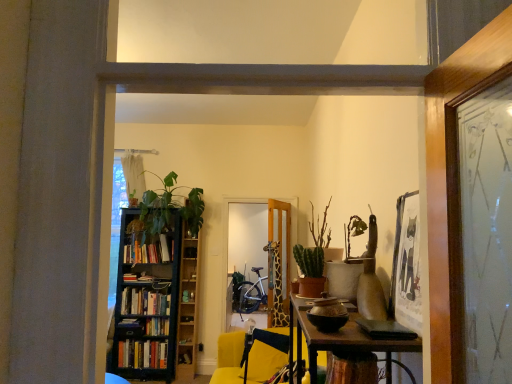
Question: Considering the relative positions of hardcover books at left, which is counted as the third book, starting from the bottom, and green matte plant at center in the image provided, is hardcover books at left, which is counted as the third book, starting from the bottom, to the left of green matte plant at center from the viewer's perspective?

Choices:
 (A) no
 (B) yes

Answer: (B)

Question: Does hardcover books at left, which is counted as the third book, starting from the bottom, have a smaller size compared to green matte plant at center?

Choices:
 (A) no
 (B) yes

Answer: (A)

Question: Can you confirm if hardcover books at left, which is counted as the third book, starting from the bottom, is shorter than green matte plant at center?

Choices:
 (A) yes
 (B) no

Answer: (A)

Question: Does hardcover books at left, which is counted as the third book, starting from the bottom, have a greater height compared to green matte plant at center?

Choices:
 (A) yes
 (B) no

Answer: (B)

Question: Does hardcover books at left, which is counted as the third book, starting from the bottom, appear on the right side of green matte plant at center?

Choices:
 (A) no
 (B) yes

Answer: (A)

Question: Is point pyautogui.click(x=304, y=251) closer or farther from the camera than point pyautogui.click(x=140, y=236)?

Choices:
 (A) farther
 (B) closer

Answer: (B)

Question: From a real-world perspective, is green matte plant at center positioned above or below black wooden bookcase at left?

Choices:
 (A) above
 (B) below

Answer: (A)

Question: Looking at the image, does green matte plant at center seem bigger or smaller compared to black wooden bookcase at left?

Choices:
 (A) small
 (B) big

Answer: (A)

Question: In the image, is green matte plant at center positioned in front of or behind black wooden bookcase at left?

Choices:
 (A) behind
 (B) front

Answer: (B)

Question: Considering the positions of point (322, 258) and point (289, 231), is point (322, 258) closer or farther from the camera than point (289, 231)?

Choices:
 (A) closer
 (B) farther

Answer: (A)

Question: Considering the positions of green matte cactus at center-right, the second plant in the back-to-front sequence, and wooden giraffe at center in the image, is green matte cactus at center-right, the second plant in the back-to-front sequence, taller or shorter than wooden giraffe at center?

Choices:
 (A) short
 (B) tall

Answer: (A)

Question: In terms of width, does green matte cactus at center-right, which ranks as the first plant in right-to-left order, look wider or thinner when compared to wooden giraffe at center?

Choices:
 (A) thin
 (B) wide

Answer: (A)

Question: From a real-world perspective, is green matte cactus at center-right, which ranks as the first plant in right-to-left order, above or below wooden giraffe at center?

Choices:
 (A) above
 (B) below

Answer: (A)

Question: Is point (324, 210) closer or farther from the camera than point (278, 311)?

Choices:
 (A) farther
 (B) closer

Answer: (B)

Question: Looking at their shapes, would you say green matte plant at center is wider or thinner than wooden giraffe at center?

Choices:
 (A) thin
 (B) wide

Answer: (A)